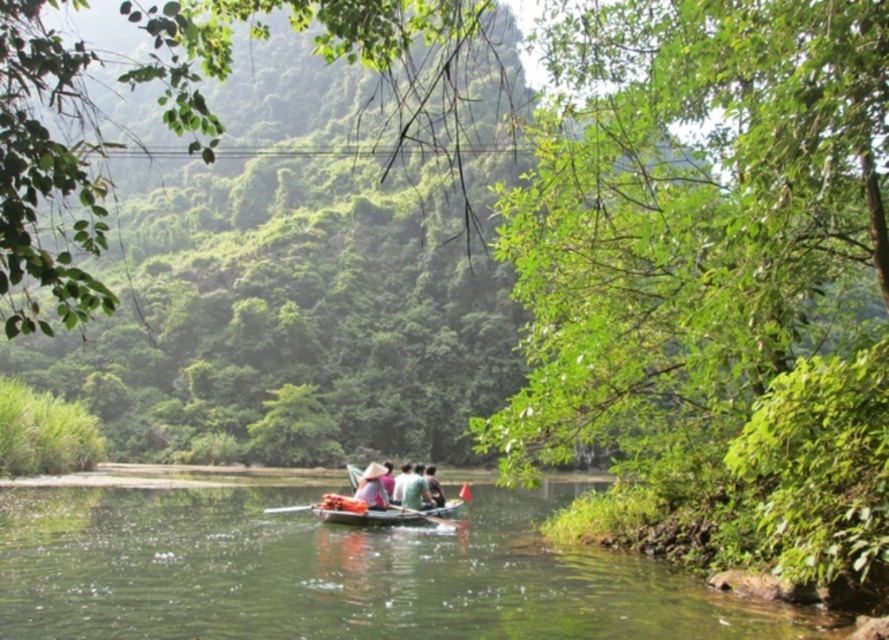
Who is positioned more to the left, green smooth water at center or wooden boat at center?

green smooth water at center is more to the left.

Identify the location of green smooth water at center. This screenshot has width=889, height=640. (337, 573).

Which is above, green smooth water at center or green fabric shirt at center?

green fabric shirt at center is above.

This screenshot has height=640, width=889. Identify the location of green smooth water at center. click(x=337, y=573).

Between wooden canoe at center and green fabric shirt at center, which one appears on the right side from the viewer's perspective?

wooden canoe at center is more to the right.

Can you confirm if wooden canoe at center is positioned below green fabric shirt at center?

Yes.

Locate an element on the screen. This screenshot has height=640, width=889. wooden canoe at center is located at coordinates (387, 515).